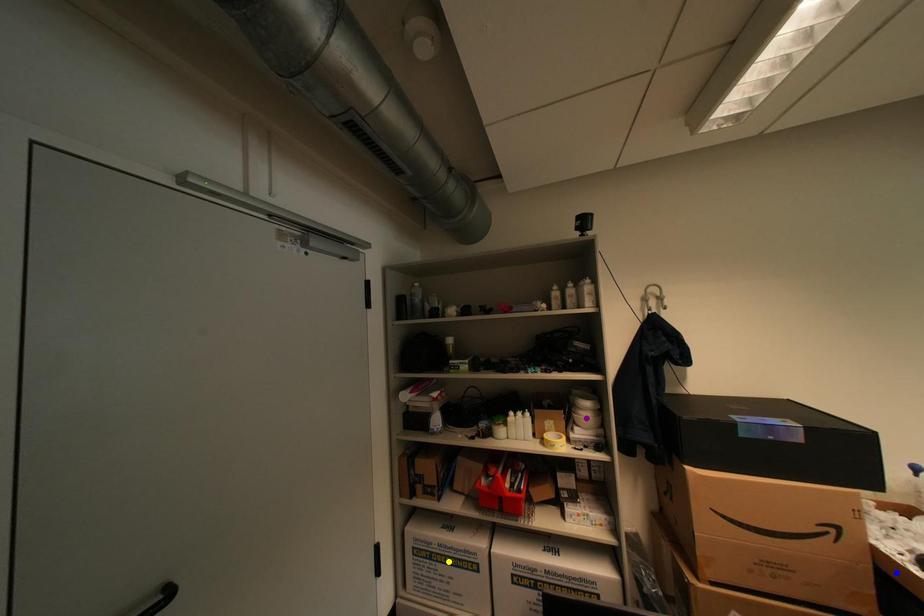
Order these from nearest to farthest:
A) purple point
B) yellow point
C) blue point

blue point → yellow point → purple point